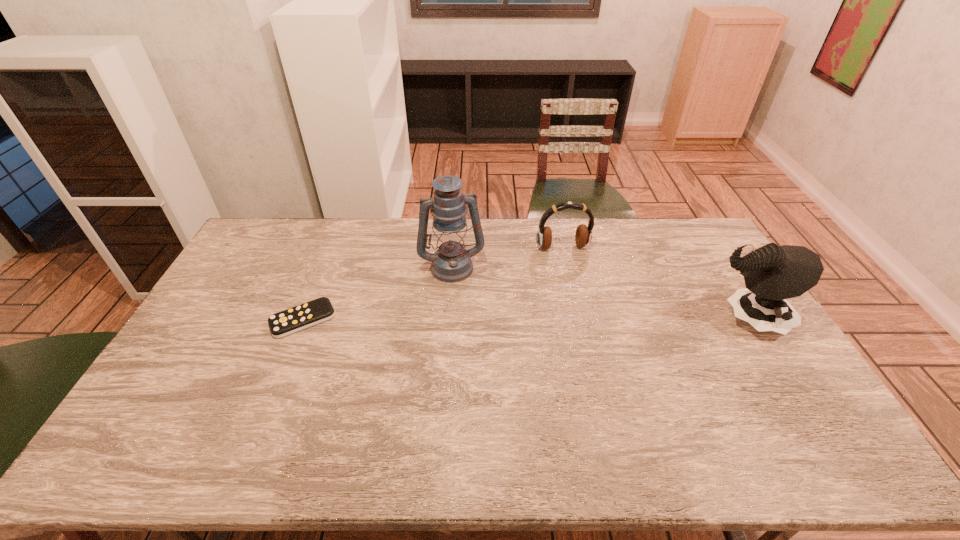
Image resolution: width=960 pixels, height=540 pixels. In the image, there is a desktop. Find the location of `blank space at the left edge`. blank space at the left edge is located at coordinates (270, 265).

Where is `free point at the right edge`? The height and width of the screenshot is (540, 960). free point at the right edge is located at coordinates (785, 376).

In order to click on vacant region at the near left corner in this screenshot , I will do `click(173, 414)`.

The width and height of the screenshot is (960, 540). I want to click on unoccupied area between the tallest object and the second object from right to left, so click(x=507, y=257).

You are a GUI agent. You are given a task and a screenshot of the screen. Output one action in this format:
    pyautogui.click(x=<x>, y=<y>)
    Task: Click on the free space that is in between the third object from right to left and the remote control
    The image size is (960, 540).
    Given the screenshot: What is the action you would take?
    pyautogui.click(x=377, y=293)

Where is `empty location between the tallest object and the doll`? empty location between the tallest object and the doll is located at coordinates (599, 293).

Find the location of a particular element. The image size is (960, 540). free area in between the doll and the leftmost object is located at coordinates (524, 320).

Where is `free space between the second shortest object and the remote control`? free space between the second shortest object and the remote control is located at coordinates (433, 284).

I want to click on free space between the third shortest object and the remote control, so click(524, 320).

Locate an element on the screen. Image resolution: width=960 pixels, height=540 pixels. vacant point located between the shortest object and the lantern is located at coordinates [377, 293].